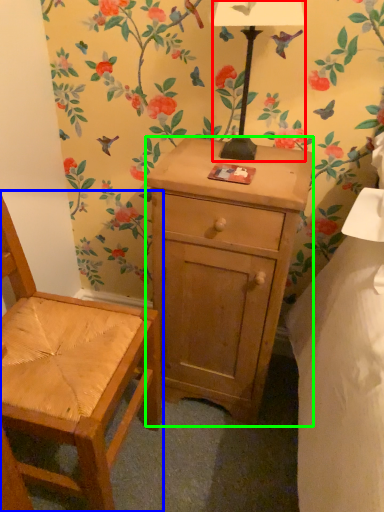
Question: Considering the real-world distances, which object is closest to lamp (highlighted by a red box)? chair (highlighted by a blue box) or desk (highlighted by a green box).

Choices:
 (A) chair
 (B) desk

Answer: (B)